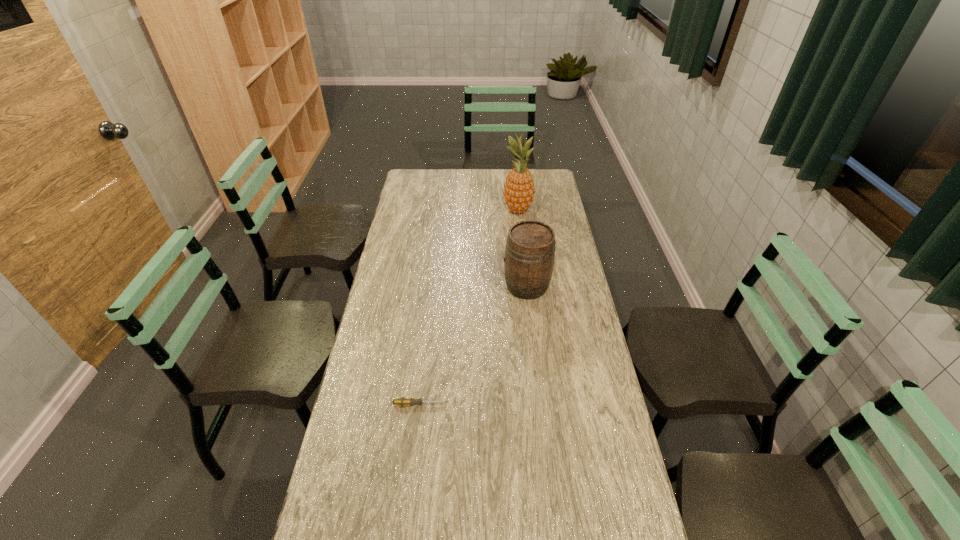
Find the location of a particular element. Image resolution: width=960 pixels, height=540 pixels. vacant region located at the tip of the screwdriver is located at coordinates (491, 404).

At what (x,y) coordinates should I click in order to perform the action: click on object situated at the left edge. Please return your answer as a coordinate pair (x, y). This screenshot has width=960, height=540. Looking at the image, I should click on (402, 401).

Identify the location of pineapple located at the right edge. (519, 190).

Identify the location of cider present at the right edge. [x=530, y=250].

The height and width of the screenshot is (540, 960). Identify the location of vacant region at the far edge. (483, 186).

In the image, there is a desktop. Where is `vacant space at the left edge`? vacant space at the left edge is located at coordinates (335, 479).

Identify the location of vacant space at the right edge of the desktop. This screenshot has height=540, width=960. [557, 356].

Where is `free space between the tallest object and the screwdriver`? This screenshot has height=540, width=960. free space between the tallest object and the screwdriver is located at coordinates (469, 307).

Where is `free space between the second shortest object and the nearest object`? free space between the second shortest object and the nearest object is located at coordinates (473, 345).

Where is `vacant space that's between the farthest object and the leftmost object`? vacant space that's between the farthest object and the leftmost object is located at coordinates (469, 307).